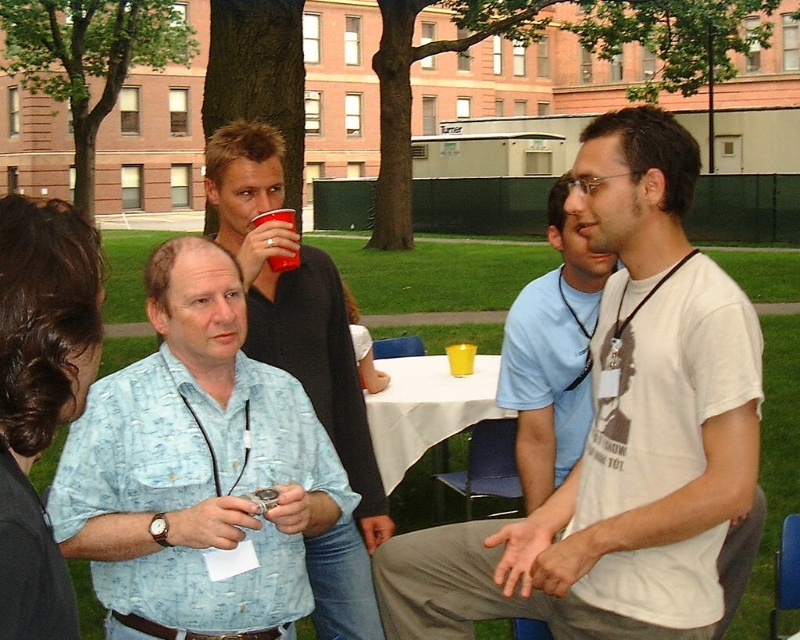
Can you confirm if white matte t-shirt at center is shorter than light blue printed shirt at center?

Incorrect, white matte t-shirt at center's height does not fall short of light blue printed shirt at center's.

Is white matte t-shirt at center to the left of light blue printed shirt at center from the viewer's perspective?

In fact, white matte t-shirt at center is to the right of light blue printed shirt at center.

In the scene shown: Who is more distant from viewer, [452,548] or [202,368]?

The point [452,548] is more distant.

Image resolution: width=800 pixels, height=640 pixels. In order to click on white matte t-shirt at center in this screenshot , I will do `click(618, 433)`.

Which is behind, point (601, 390) or point (274, 266)?

Positioned behind is point (274, 266).

Can you confirm if white matte t-shirt at center is positioned to the right of red plastic cup at upper center?

Yes, white matte t-shirt at center is to the right of red plastic cup at upper center.

Does point (592, 509) come behind point (258, 225)?

No.

Identify the location of white matte t-shirt at center. The width and height of the screenshot is (800, 640). (618, 433).

Does light blue printed shirt at center have a lesser width compared to matte black shirt at center?

No.

Who is taller, light blue printed shirt at center or matte black shirt at center?

With more height is matte black shirt at center.

Locate an element on the screen. This screenshot has width=800, height=640. light blue printed shirt at center is located at coordinates (196, 464).

Locate an element on the screen. The height and width of the screenshot is (640, 800). light blue printed shirt at center is located at coordinates (196, 464).